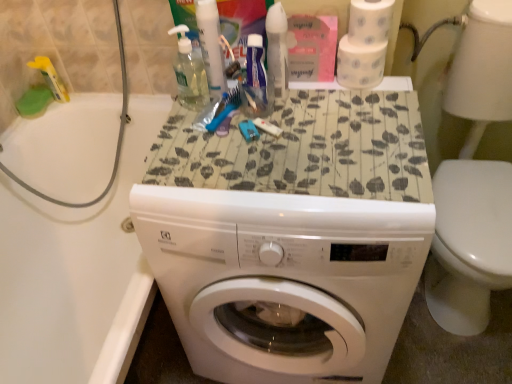
Find the location of `vacant space to the right of translucent plastic spray bottle at upper center, which is the second cleaning product from left to right`. vacant space to the right of translucent plastic spray bottle at upper center, which is the second cleaning product from left to right is located at coordinates (337, 100).